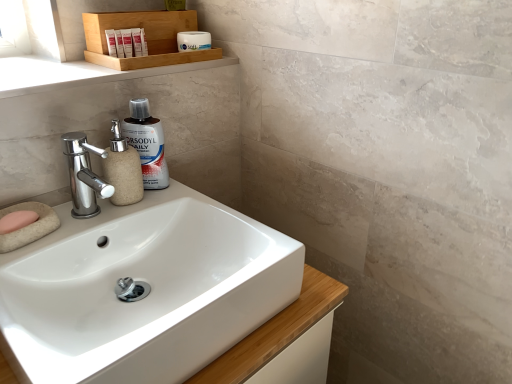
I want to click on vacant area that is in front of white matte tube at upper center, the second toiletry in the left-to-right sequence, so pos(82,72).